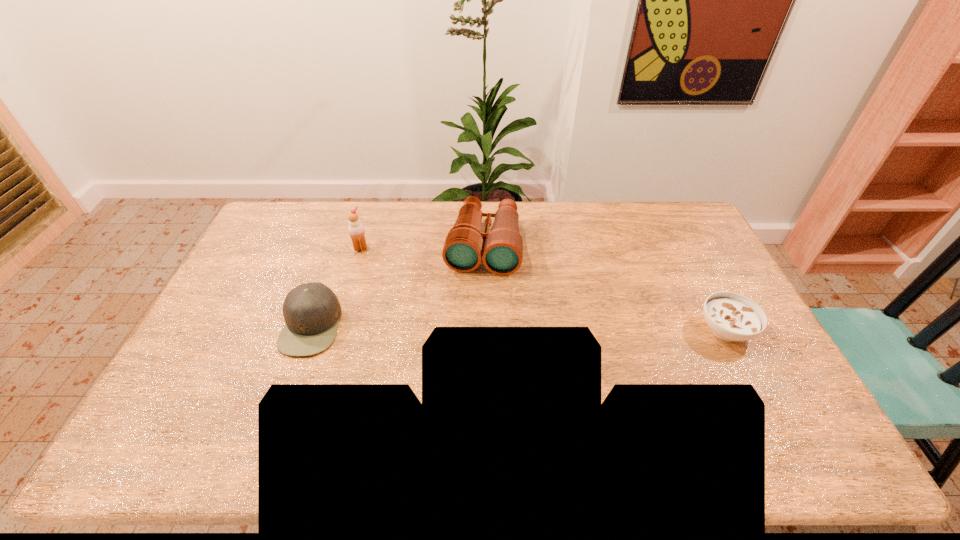
You are a GUI agent. You are given a task and a screenshot of the screen. Output one action in this format:
    pyautogui.click(x=<x>, y=<y>)
    Task: Click on the cap
    This screenshot has width=960, height=540.
    Given the screenshot: What is the action you would take?
    pyautogui.click(x=311, y=311)

Find the location of a particular element. This screenshot has height=540, width=960. the rightmost object is located at coordinates (730, 316).

Locate an element on the screen. the shortest object is located at coordinates (730, 316).

Find the location of `binoculars`. binoculars is located at coordinates (501, 250).

Locate an element on the screen. Image resolution: width=960 pixels, height=540 pixels. the third object from left to right is located at coordinates tap(501, 250).

Locate an element on the screen. The width and height of the screenshot is (960, 540). icecream is located at coordinates tap(356, 230).

Where is `vacant space located 0.170m on the brim of the third tallest object`? vacant space located 0.170m on the brim of the third tallest object is located at coordinates (227, 325).

The height and width of the screenshot is (540, 960). What are the coordinates of `blank space located on the brim of the third tallest object` in the screenshot? It's located at (247, 325).

The height and width of the screenshot is (540, 960). I want to click on free spot located on the brim of the third tallest object, so click(x=260, y=325).

Locate an element on the screen. The height and width of the screenshot is (540, 960). vacant region located 0.320m on the back of the rightmost object is located at coordinates (681, 242).